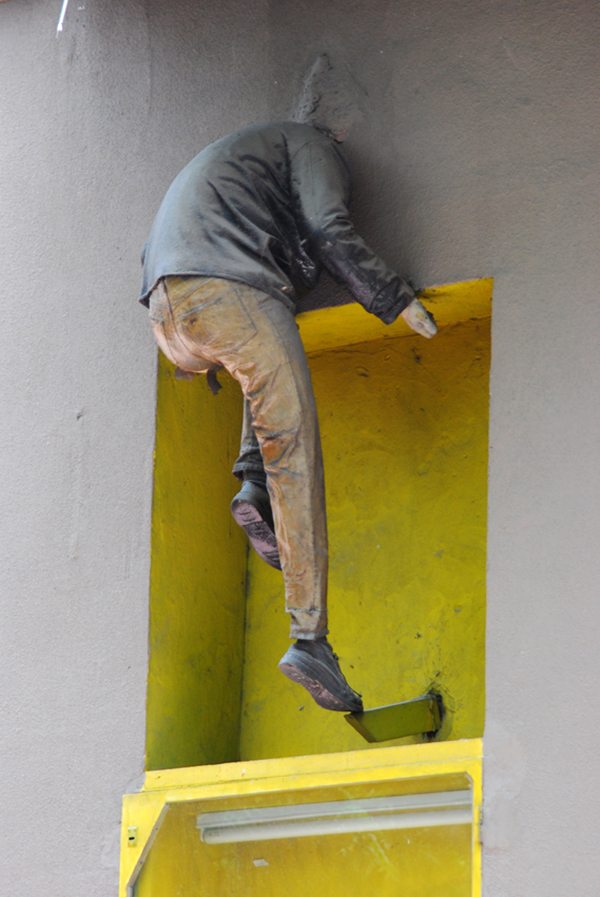
Locate an element on the screen. The image size is (600, 897). white tube light bulb is located at coordinates (211, 837).